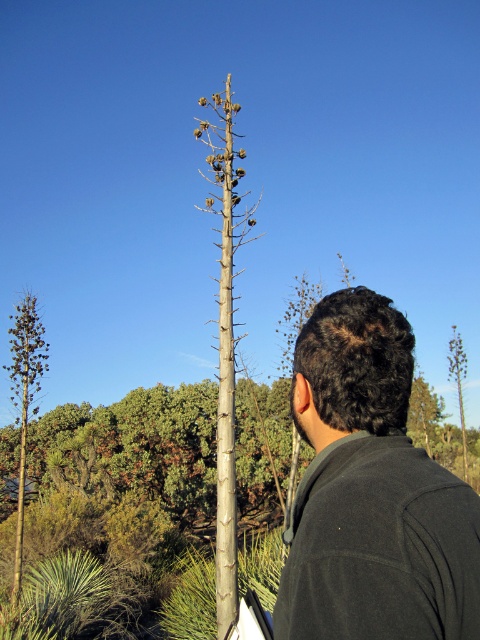
The image size is (480, 640). Describe the element at coordinates (226, 342) in the screenshot. I see `bare wood tree at center` at that location.

Who is shorter, bare wood tree at center or green leafy tree at left?

With less height is green leafy tree at left.

Who is more forward, (x=224, y=289) or (x=23, y=403)?

Point (x=224, y=289) is more forward.

Where is `bare wood tree at center`? This screenshot has height=640, width=480. bare wood tree at center is located at coordinates (226, 342).

Between point (346, 636) and point (24, 300), which one is positioned behind?

The point (24, 300) is more distant.

Does dark gray/black fabric at center come behind green leafy tree at left?

No, it is not.

Where is `dark gray/black fabric at center`? dark gray/black fabric at center is located at coordinates (372, 492).

Consider the image. Who is more distant from viewer, (320, 301) or (226, 204)?

Positioned behind is point (226, 204).

Which is below, dark gray/black fabric at center or bare wood tree at center?

Positioned lower is bare wood tree at center.

Is point (344, 616) closer to camera compared to point (224, 356)?

That is True.

The width and height of the screenshot is (480, 640). I want to click on dark gray/black fabric at center, so click(x=372, y=492).